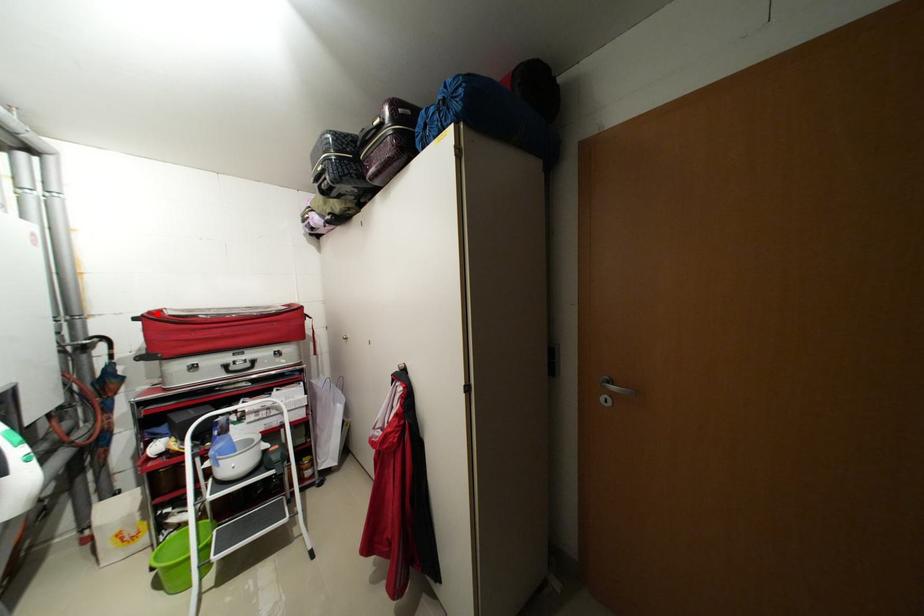
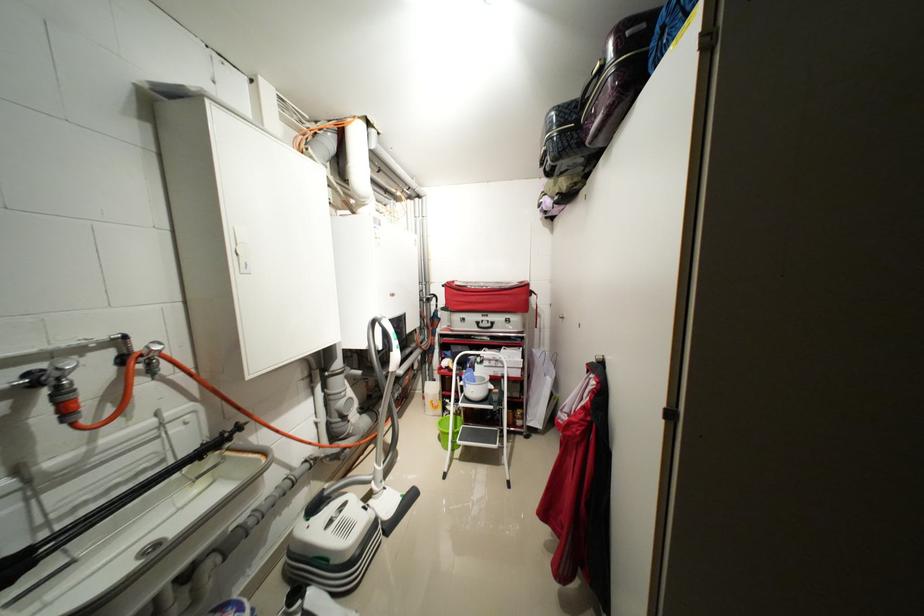
The point at the highlighted location is marked in the first image. Where is the corresponding point in the second image?

(455, 284)